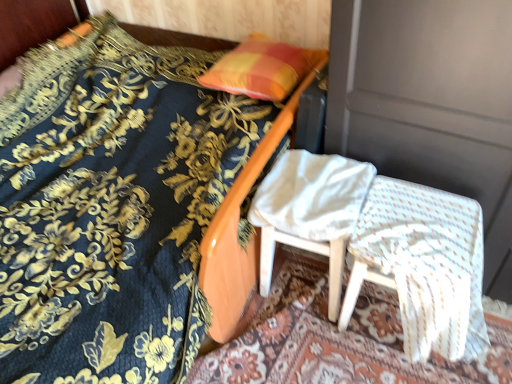
Question: Is white woven fabric chair at lower right, which is the second chair from left to right, bigger or smaller than white wood chair at center, the second chair from the right?

Choices:
 (A) small
 (B) big

Answer: (B)

Question: Is white woven fabric chair at lower right, the 1th chair from the right, taller or shorter than white wood chair at center, the second chair from the right?

Choices:
 (A) short
 (B) tall

Answer: (A)

Question: Which object is positioned farthest from the white wood chair at center, the second chair from the right?

Choices:
 (A) orange/yellow fabric pillow at upper center
 (B) velvet blue bedspread at upper left
 (C) white woven fabric chair at lower right, the 1th chair from the right

Answer: (B)

Question: Considering the real-world distances, which object is farthest from the velvet blue bedspread at upper left?

Choices:
 (A) white wood chair at center, the second chair from the right
 (B) orange/yellow fabric pillow at upper center
 (C) white woven fabric chair at lower right, which is the second chair from left to right

Answer: (C)